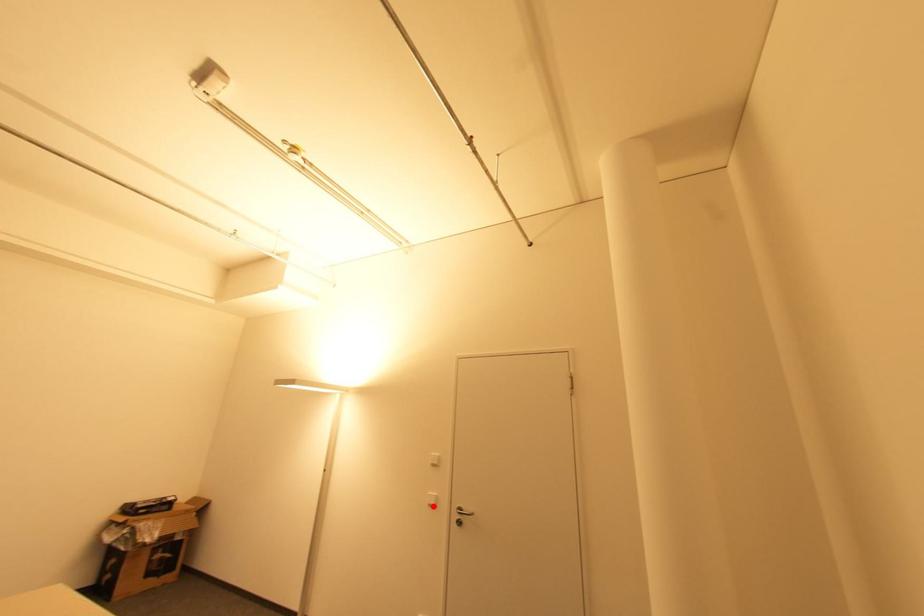
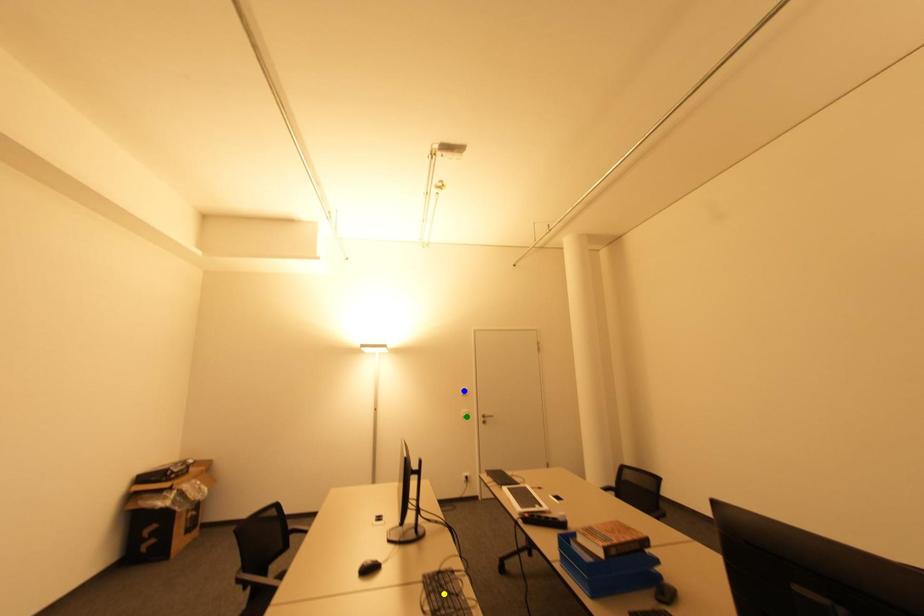
Question: I am providing you with two images of the same scene from different viewpoints. A red point is marked on the first image. You are given multiple points on the second image. Which spot in image 2 lines up with the point in image 1?

Choices:
 (A) green point
 (B) blue point
 (C) yellow point

Answer: (A)